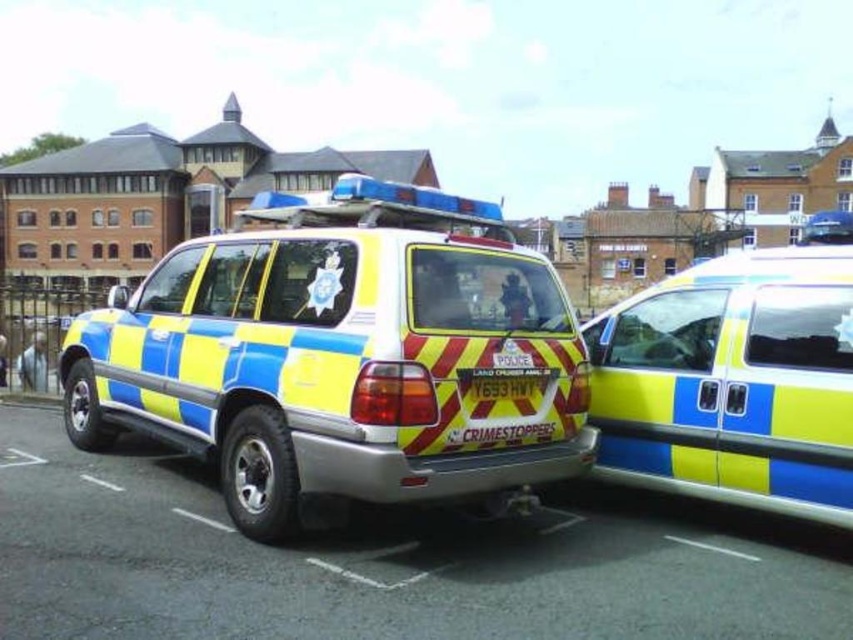
Does blue and yellow striped police vehicle at center have a greater width compared to yellow and blue striped police vehicle at right?

No.

Is blue and yellow striped police vehicle at center positioned behind yellow and blue striped police vehicle at right?

No.

Which is behind, point (492, 323) or point (836, 436)?

The point (492, 323) is behind.

The height and width of the screenshot is (640, 853). Find the location of `blue and yellow striped police vehicle at center`. blue and yellow striped police vehicle at center is located at coordinates (341, 355).